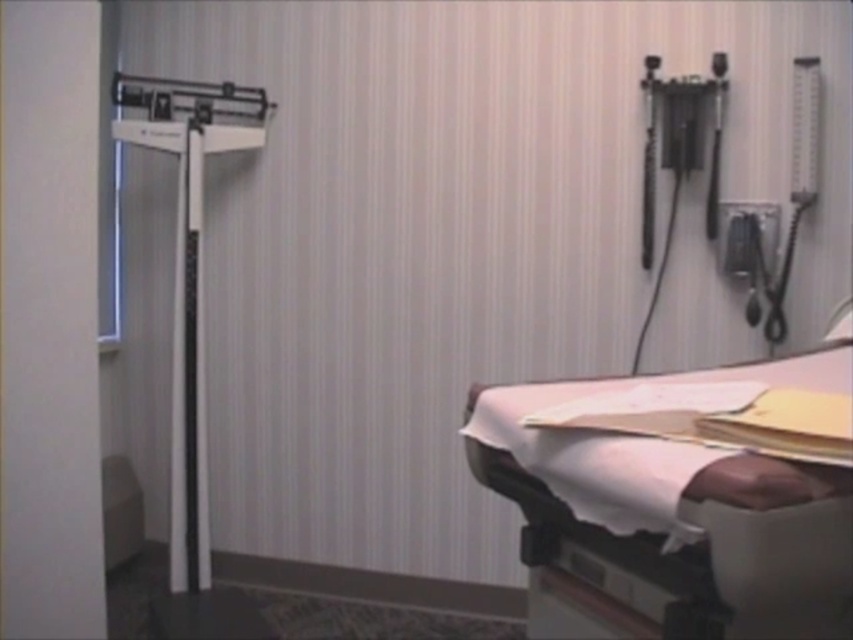
Between white fabric hospital bed at lower right and white plastic scale at left, which one has more height?

With more height is white plastic scale at left.

Is point (548, 483) farther from viewer compared to point (213, 122)?

No, (548, 483) is in front of (213, 122).

The width and height of the screenshot is (853, 640). In order to click on white fabric hospital bed at lower right in this screenshot , I will do `click(670, 518)`.